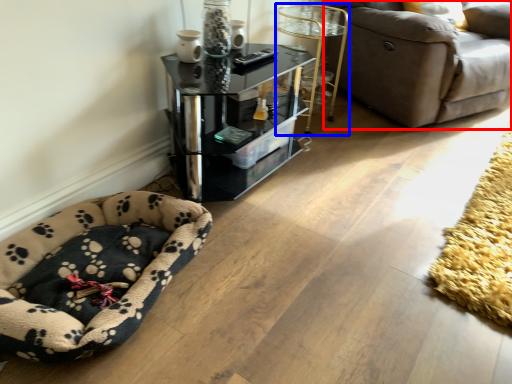
Question: Which point is closer to the camera, studio couch (highlighted by a red box) or side table (highlighted by a blue box)?

Choices:
 (A) studio couch
 (B) side table

Answer: (A)